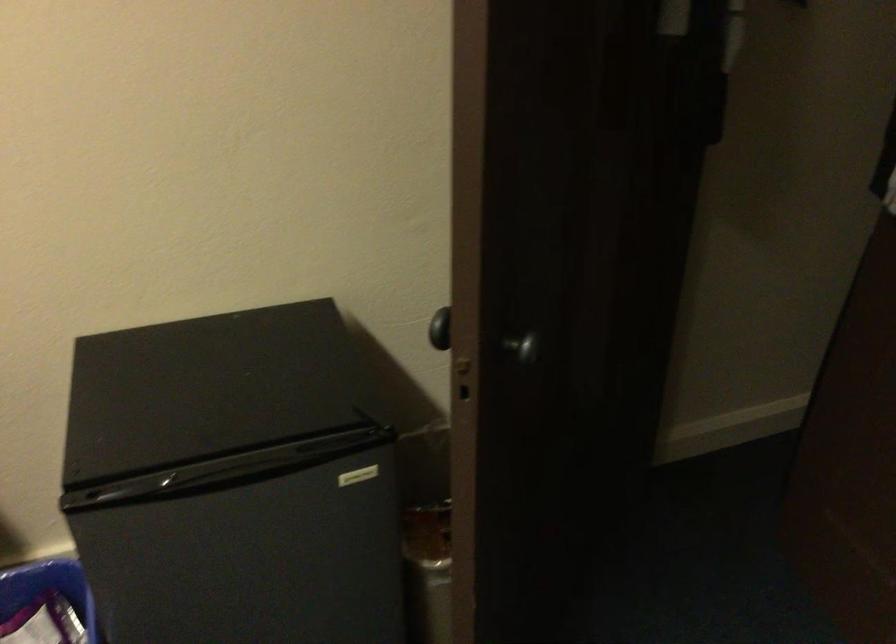
The width and height of the screenshot is (896, 644). Find the location of `fridge door handle`. fridge door handle is located at coordinates (358, 476).